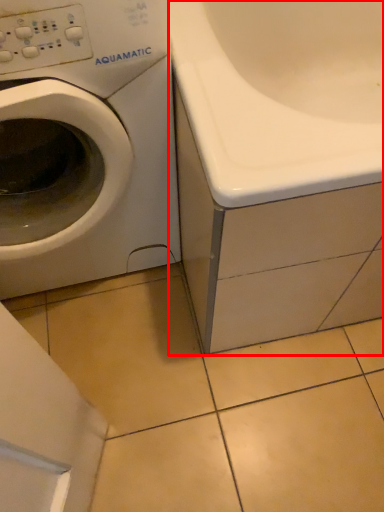
Question: From the image's perspective, considering the relative positions of bath (annotated by the red box) and washing machine in the image provided, where is bath (annotated by the red box) located with respect to the staircase?

Choices:
 (A) above
 (B) below

Answer: (A)